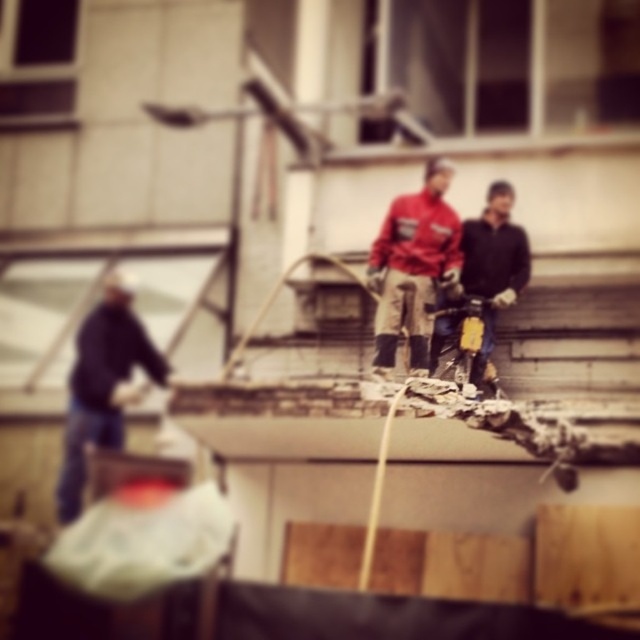
You are navigating a drone over a construction site. There are two points of interest marked as point 1 at coordinates (394,288) and point 2 at (120,276). Based on the scene description, which point is closer to the drone when it is positioned above the elevated platform where the two workers are standing?

Point 1 at coordinates (394,288) is closer to the drone because it is in front of point 2 at (120,276), meaning it is nearer to the observer or drone position.